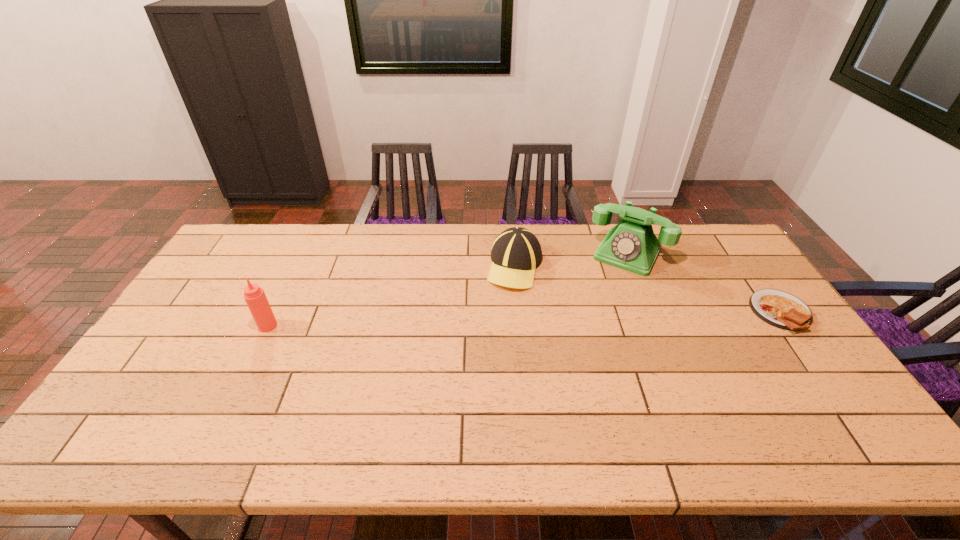
In the image, there is a desktop. Where is `free space at the right edge`? The height and width of the screenshot is (540, 960). free space at the right edge is located at coordinates (733, 265).

Image resolution: width=960 pixels, height=540 pixels. In order to click on vacant space at the far left corner of the desktop in this screenshot , I will do `click(257, 232)`.

What are the coordinates of `free spot at the far right corner of the desktop` in the screenshot? It's located at (705, 247).

Identify the location of free area in between the third object from right to left and the second object from right to left. The image size is (960, 540). (571, 260).

This screenshot has height=540, width=960. What are the coordinates of `vacant region between the omelet and the third object from right to left` in the screenshot? It's located at (648, 289).

Identify the location of blank region between the omelet and the third tallest object. (648, 289).

Locate an element on the screen. This screenshot has height=540, width=960. free space between the shortest object and the second object from right to left is located at coordinates (704, 283).

Identify the location of free space between the omelet and the telephone. (704, 283).

The height and width of the screenshot is (540, 960). I want to click on empty location between the leftmost object and the telephone, so click(x=447, y=289).

Where is `vacant space that is in between the telephone and the third object from right to left`? vacant space that is in between the telephone and the third object from right to left is located at coordinates (571, 260).